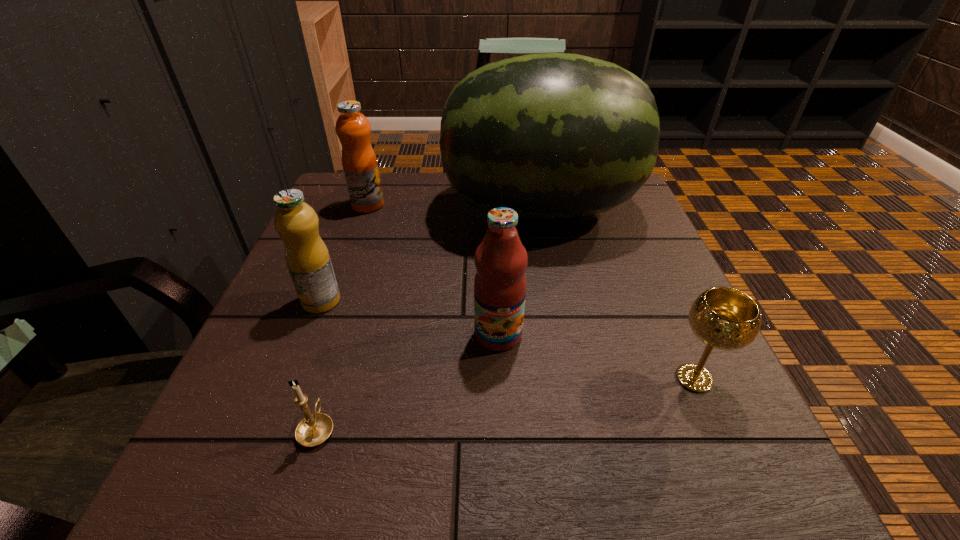
The height and width of the screenshot is (540, 960). What are the coordinates of `candle holder present at the left edge` in the screenshot? It's located at (314, 429).

You are a GUI agent. You are given a task and a screenshot of the screen. Output one action in this format:
    pyautogui.click(x=<x>, y=<y>)
    Task: Click on the watermelon located at the right edge
    The image size is (960, 540).
    Given the screenshot: What is the action you would take?
    pyautogui.click(x=551, y=135)

Image resolution: width=960 pixels, height=540 pixels. Find the location of `chalice that is at the right edge`. chalice that is at the right edge is located at coordinates (723, 318).

Find the location of a particular element. The width and height of the screenshot is (960, 540). object at the far left corner is located at coordinates 353,129.

Find the location of `object that is at the near left corner`. object that is at the near left corner is located at coordinates (314, 429).

Locate an element on the screen. The height and width of the screenshot is (540, 960). object at the far right corner is located at coordinates (551, 135).

In order to click on free space at the far edge of the desktop in this screenshot , I will do `click(432, 211)`.

Find the location of `free location at the near edge`. free location at the near edge is located at coordinates pos(426,446).

This screenshot has width=960, height=540. What are the coordinates of `blank area at the left edge` in the screenshot? It's located at (x=294, y=291).

In the image, there is a desktop. Identify the location of vacant space at the right edge. (645, 224).